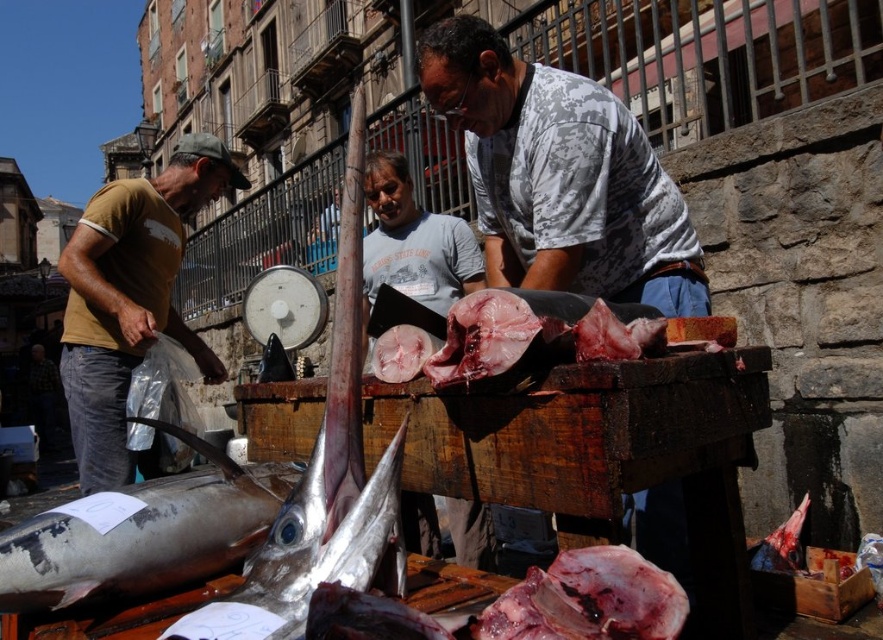
Who is taller, silver metallic fish at lower left or dark red flesh at center?

silver metallic fish at lower left is taller.

Identify the location of silver metallic fish at lower left. (141, 534).

I want to click on silver metallic fish at lower left, so click(141, 534).

I want to click on silver metallic fish at lower left, so (141, 534).

Is yellow t-shirt at left to the left of dark red flesh at center from the viewer's perspective?

Indeed, yellow t-shirt at left is positioned on the left side of dark red flesh at center.

Who is more distant from viewer, (114,404) or (532,602)?

Point (114,404)

Who is more forward, (89, 356) or (620, 576)?

Positioned in front is point (620, 576).

At what (x,y) coordinates should I click in order to perform the action: click on yellow t-shirt at left. Please return your answer as a coordinate pair (x, y). The width and height of the screenshot is (883, 640). Looking at the image, I should click on (130, 298).

Between point (106, 481) and point (217, 544), which one is positioned in front?

Point (217, 544) is in front.

Is point (82, 372) farther from viewer compared to point (1, 604)?

Yes, point (82, 372) is behind point (1, 604).

Locate an element on the screen. The image size is (883, 640). yellow t-shirt at left is located at coordinates (130, 298).